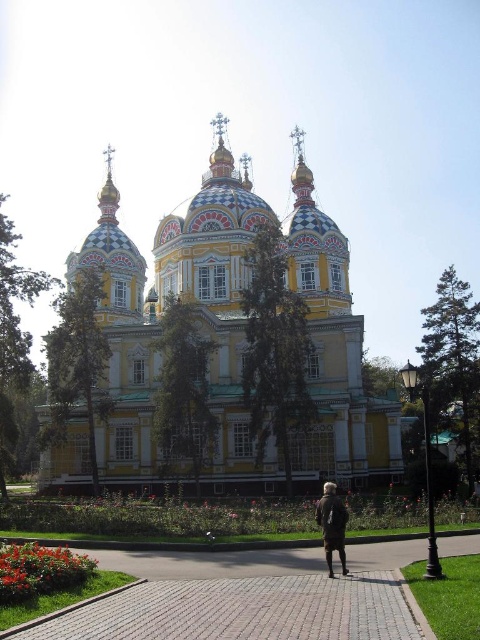
Question: Which of the following is the farthest from the observer?

Choices:
 (A) dark brown fur coat at center
 (B) brick paved walkway at lower center

Answer: (A)

Question: Estimate the real-world distances between objects in this image. Which object is farther from the brick paved walkway at lower center?

Choices:
 (A) dark brown fur coat at center
 (B) painted wood church at center

Answer: (B)

Question: Is painted wood church at center to the right of brick paved walkway at lower center from the viewer's perspective?

Choices:
 (A) no
 (B) yes

Answer: (A)

Question: Considering the real-world distances, which object is closest to the dark brown fur coat at center?

Choices:
 (A) painted wood church at center
 (B) brick paved walkway at lower center

Answer: (B)

Question: Does painted wood church at center have a lesser width compared to dark brown fur coat at center?

Choices:
 (A) no
 (B) yes

Answer: (A)

Question: Is painted wood church at center smaller than brick paved walkway at lower center?

Choices:
 (A) yes
 (B) no

Answer: (B)